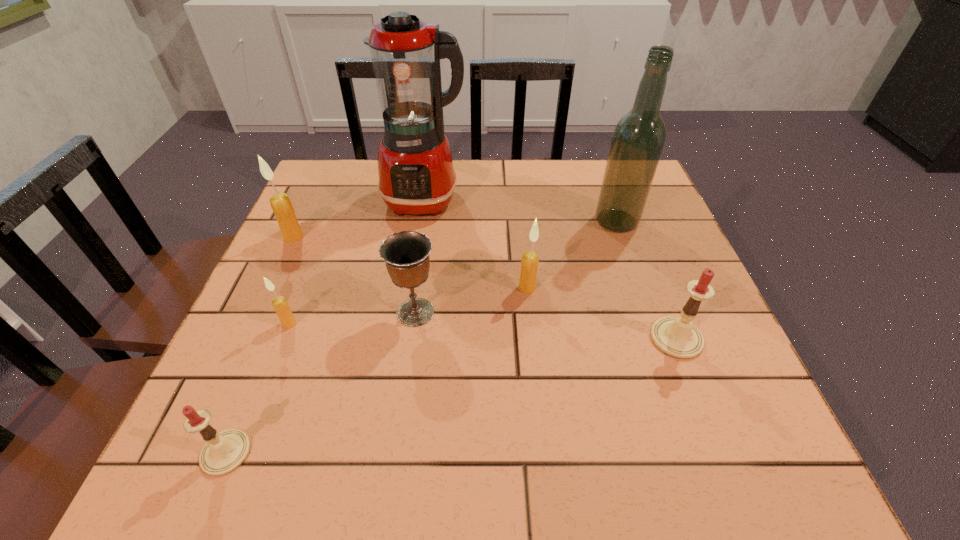
This screenshot has width=960, height=540. In the image, there is a desktop. What are the coordinates of `vacant space at the left edge` in the screenshot? It's located at (329, 248).

The image size is (960, 540). Find the location of `free spot at the right edge of the desktop`. free spot at the right edge of the desktop is located at coordinates (654, 261).

The image size is (960, 540). Identify the location of vacant region at the far left corner of the desktop. (357, 191).

Where is `free space at the far right corner of the desktop`? free space at the far right corner of the desktop is located at coordinates (590, 176).

Identify the location of vacant area that lies between the liquor and the food processor. (520, 211).

In order to click on vacant space in between the food processor and the farthest candle in this screenshot , I will do `click(359, 219)`.

Where is `free space between the green liquor and the tallest candle`? Image resolution: width=960 pixels, height=540 pixels. free space between the green liquor and the tallest candle is located at coordinates pyautogui.click(x=455, y=229).

At what (x,y) coordinates should I click in order to perform the action: click on free space between the chalice and the tallest candle. Please return your answer as a coordinate pair (x, y). Looking at the image, I should click on (354, 274).

Where is `free spot between the second cream candle from left to right and the liquor`? Image resolution: width=960 pixels, height=540 pixels. free spot between the second cream candle from left to right and the liquor is located at coordinates (453, 273).

I want to click on vacant space that's between the biggest cream candle and the rightmost candle, so click(485, 288).